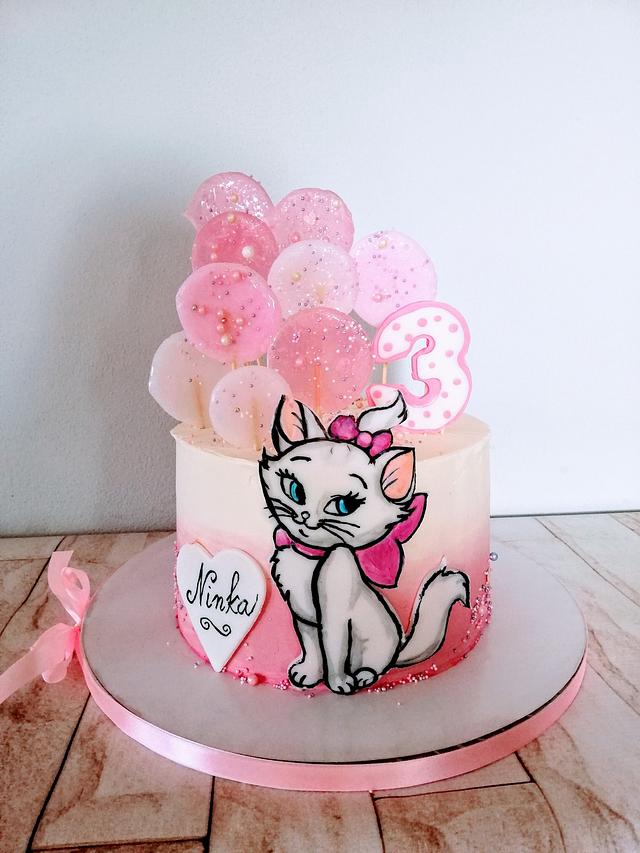
You are a GUI agent. You are given a task and a screenshot of the screen. Output one action in this format:
    pyautogui.click(x=<x>, y=<y>)
    Task: Click on the pink bow on cake stand
    The width and height of the screenshot is (640, 853).
    Given the screenshot: What is the action you would take?
    pyautogui.click(x=362, y=775)